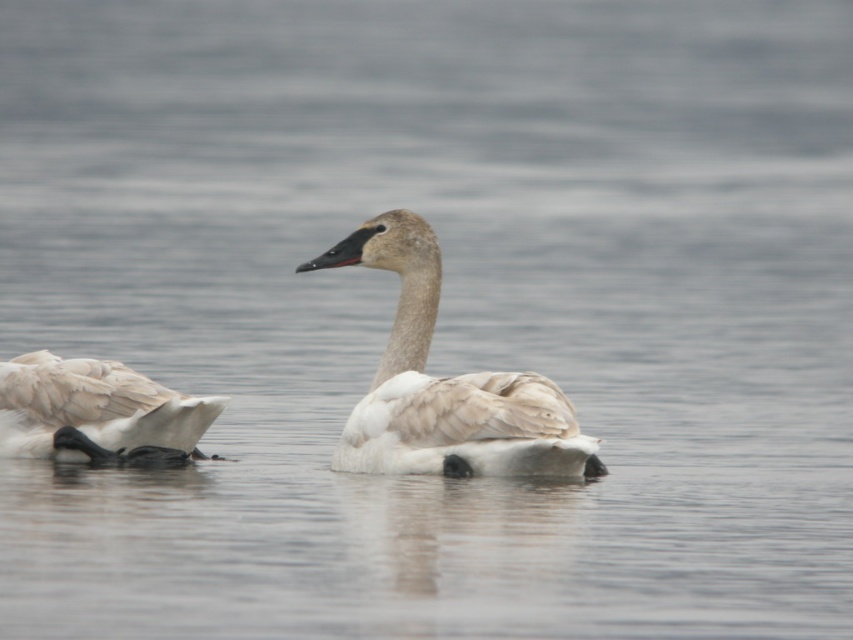
What do you see at coordinates (445, 385) in the screenshot? I see `white feathered swan at center` at bounding box center [445, 385].

Who is more distant from viewer, (x=434, y=397) or (x=154, y=412)?

Point (x=154, y=412)

Based on the photo, who is more distant from viewer, (509, 468) or (56, 426)?

The point (56, 426) is more distant.

I want to click on white feathered swan at center, so click(445, 385).